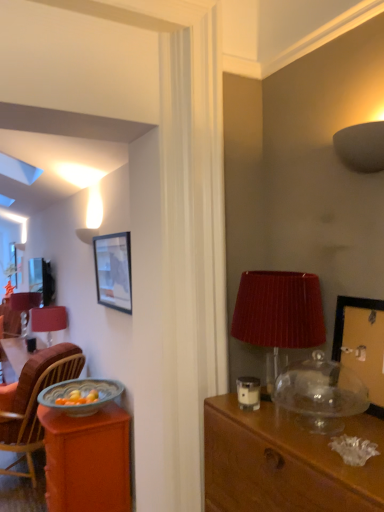
Question: Looking at their shapes, would you say matte gray lampshade at upper right, positioned as the 1th lamp in right-to-left order, is wider or thinner than matte red lampshade at left, the 1th lamp positioned from the back?

Choices:
 (A) wide
 (B) thin

Answer: (B)

Question: Would you say matte gray lampshade at upper right, arranged as the first lamp when viewed from the front, is to the left or to the right of matte red lampshade at left, positioned as the third lamp in right-to-left order, in the picture?

Choices:
 (A) right
 (B) left

Answer: (A)

Question: Estimate the real-world distances between objects in this image. Which object is closer to the matte red lampshade at left, the 1th lamp positioned from the back?

Choices:
 (A) matte black picture frame at upper left, placed as the first picture frame when sorted from back to front
 (B) matte red table lamp at left
 (C) translucent glass bowl at lower left
 (D) matte gray lampshade at upper right, arranged as the first lamp when viewed from the front
 (E) orange wood desk at left, the 2th desk in the front-to-back sequence

Answer: (B)

Question: Which is nearer to the translucent glass bowl at lower left?

Choices:
 (A) matte red table lamp at left
 (B) orange wood desk at left, marked as the 2th desk in a right-to-left arrangement
 (C) wooden chair at left
 (D) wooden picture frame at upper right, positioned as the 2th picture frame in left-to-right order
 (E) matte black picture frame at upper left, which is the 2th picture frame in front-to-back order

Answer: (B)